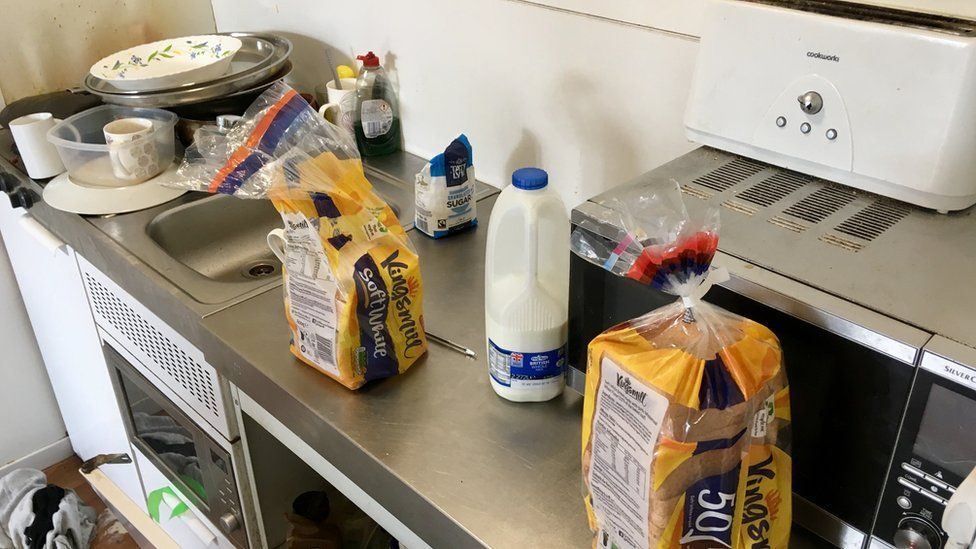
Where is `bowl`? The height and width of the screenshot is (549, 976). bowl is located at coordinates pyautogui.click(x=170, y=54).